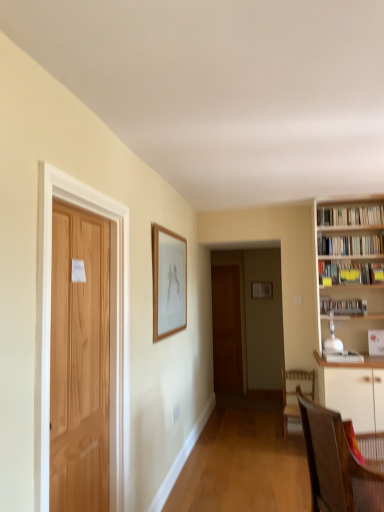
Question: Is white glossy bookshelf at right, placed as the 3th book when sorted from bottom to top, inside or outside of white paper bookshelf at upper right, which is counted as the fourth book, starting from the bottom?

Choices:
 (A) inside
 (B) outside

Answer: (B)

Question: In the image, is white glossy bookshelf at right, placed as the 3th book when sorted from bottom to top, positioned in front of or behind white paper bookshelf at upper right, which is counted as the fourth book, starting from the bottom?

Choices:
 (A) front
 (B) behind

Answer: (A)

Question: Estimate the real-world distances between objects in this image. Which object is farther from the wooden door at center, the second door from the front?

Choices:
 (A) yellow paper at upper right, the 2th book ordered from the bottom
 (B) brown wooden chair at lower right, the 1th chair when ordered from back to front
 (C) white paper bookshelf at upper right, which is the first book in top-to-bottom order
 (D) wooden picture frame at upper center, which is the second picture frame from back to front
 (E) metallic silver bookshelf at right, which is the 1th book from bottom to top

Answer: (C)

Question: Which of these objects is positioned closest to the white glossy bookshelf at right, which ranks as the second book in top-to-bottom order?

Choices:
 (A) brown woven chair at lower right, the first chair viewed from the front
 (B) brown wooden chair at lower right, which is counted as the second chair, starting from the front
 (C) wooden door at center, which appears as the first door when viewed from the right
 (D) white paper bookshelf at upper right, which is the first book in top-to-bottom order
 (E) metallic silver bookshelf at right, which is the 1th book from bottom to top

Answer: (D)